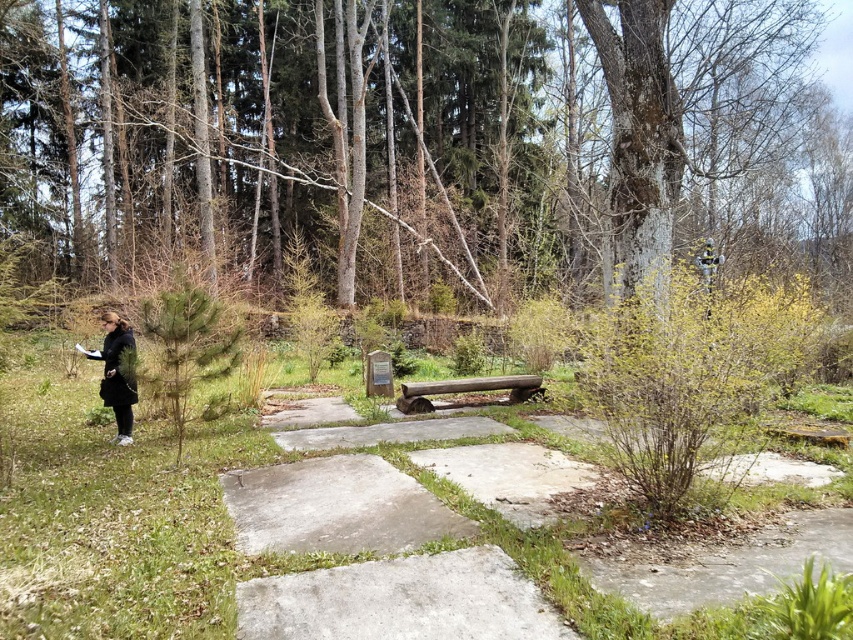
You are a hiker who wants to walk along the smooth concrete path at center without getting your black fabric jacket at left dirty. Is the path clear of any obstacles or debris?

The smooth concrete path at center is located below black fabric jacket at left, but this spatial relationship does not indicate any obstacles or debris on the path. The scene description mentions the path is paved with large flat stones and appears weathered, so it is likely clear for walking.

You are standing at the beginning of the smooth concrete path at center and want to sit on the smooth wooden bench at center. Which direction should you walk to reach the bench?

The smooth wooden bench at center is further away from you than the smooth concrete path at center, so you should walk forward along the path to reach it.